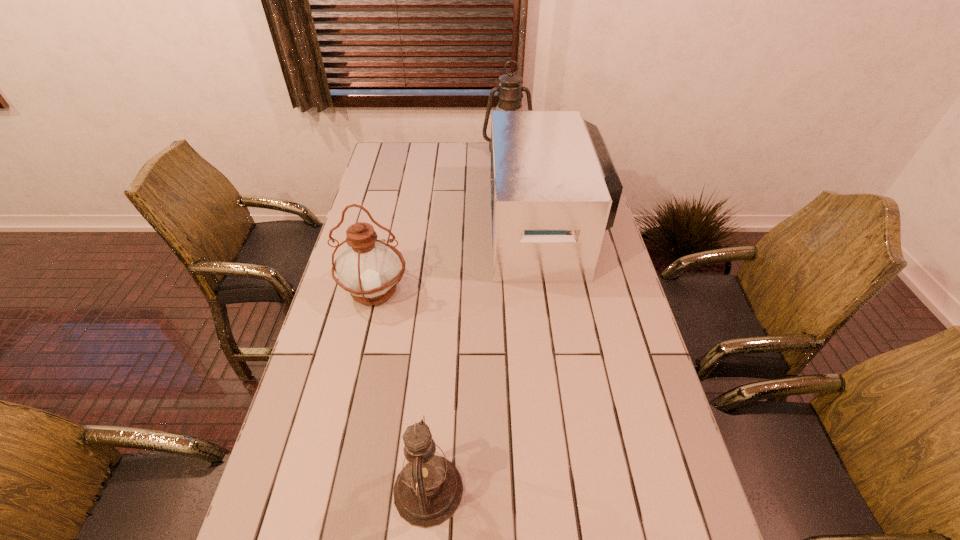
Locate an element on the screen. vacant space situated on the front-facing side of the microwave oven is located at coordinates point(396,227).

Find the location of `free point located on the front-facing side of the microwave oven`. free point located on the front-facing side of the microwave oven is located at coordinates (464, 227).

The width and height of the screenshot is (960, 540). I want to click on free region located on the left of the third object from right to left, so click(x=337, y=490).

I want to click on object positioned at the far edge, so click(x=510, y=89).

Image resolution: width=960 pixels, height=540 pixels. Identify the location of object located in the left edge section of the desktop. (368, 268).

This screenshot has height=540, width=960. I want to click on object at the right edge, so point(554,188).

I want to click on free space at the left edge of the desktop, so click(x=398, y=189).

At what (x,y) coordinates should I click in order to perform the action: click on vacant space at the right edge of the desktop. Please return your answer as a coordinate pair (x, y). Looking at the image, I should click on 580,323.

You are a GUI agent. You are given a task and a screenshot of the screen. Output one action in this format:
    pyautogui.click(x=<x>, y=<y>)
    Task: Click on the empty space that is in between the second nearest oil lamp and the microwave oven
    
    Given the screenshot: What is the action you would take?
    pyautogui.click(x=461, y=259)

The image size is (960, 540). I want to click on vacant space that is in between the rightmost oil lamp and the second oil lamp from left to right, so click(468, 320).